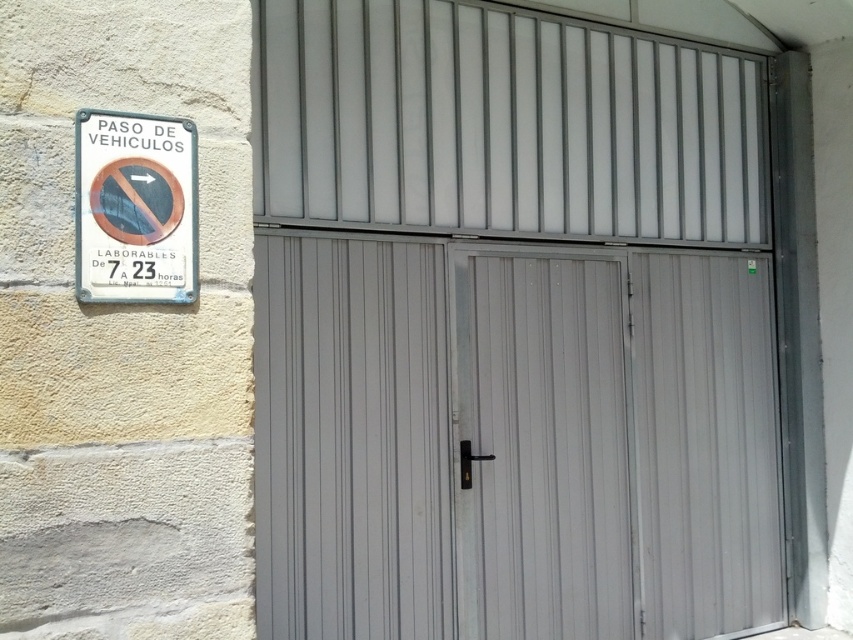
Question: Which of the following is the farthest from the observer?

Choices:
 (A) (282, 241)
 (B) (125, 209)

Answer: (A)

Question: Observing the image, what is the correct spatial positioning of metallic gray door at center in reference to white matte door at center?

Choices:
 (A) above
 (B) below

Answer: (A)

Question: Is metallic gray door at center bigger than white metal sign at upper left?

Choices:
 (A) yes
 (B) no

Answer: (A)

Question: Among these points, which one is nearest to the camera?

Choices:
 (A) (503, 337)
 (B) (660, 486)

Answer: (A)

Question: Which of the following is the farthest from the observer?

Choices:
 (A) white matte door at center
 (B) metallic gray door at center

Answer: (A)

Question: Does white matte door at center appear on the left side of white metal sign at upper left?

Choices:
 (A) yes
 (B) no

Answer: (B)